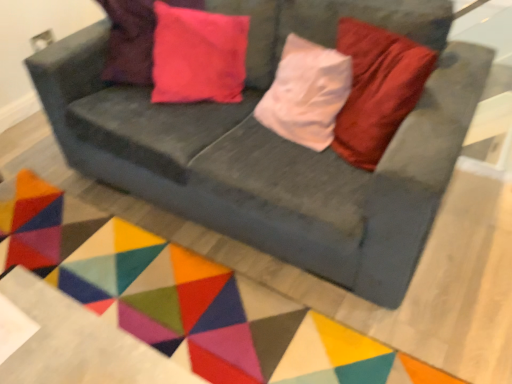
What do you see at coordinates (187, 299) in the screenshot? The height and width of the screenshot is (384, 512). I see `geometric fabric mat at center` at bounding box center [187, 299].

Find the location of `geometric fabric mat at center`. geometric fabric mat at center is located at coordinates (187, 299).

Is velvet gray couch at center facing towards pink velvet pillow at upper left?

Yes, velvet gray couch at center is turned towards pink velvet pillow at upper left.

Which object is positioned more to the left, velvet gray couch at center or pink velvet pillow at upper left?

pink velvet pillow at upper left.

Is velvet gray couch at center in contact with pink velvet pillow at upper left?

velvet gray couch at center and pink velvet pillow at upper left are not in contact.

Based on the photo, between velvet gray couch at center and pink velvet pillow at upper left, which one has larger width?

Wider between the two is velvet gray couch at center.

From a real-world perspective, which is physically above, velvet gray couch at center or geometric fabric mat at center?

velvet gray couch at center.

Is the depth of velvet gray couch at center greater than that of geometric fabric mat at center?

No, velvet gray couch at center is closer to the viewer.

At what (x,y) coordinates should I click in order to perform the action: click on studio couch located above the geometric fabric mat at center (from the image's perspective). Please return your answer as a coordinate pair (x, y). The image size is (512, 384). Looking at the image, I should click on (276, 145).

Is point (132, 131) closer or farther from the camera than point (114, 269)?

Point (132, 131) appears to be closer to the viewer than point (114, 269).

This screenshot has height=384, width=512. In order to click on pillow above the velvet gray couch at center (from a real-world perspective) in this screenshot , I will do `click(198, 55)`.

Does pink velvet pillow at upper left have a smaller size compared to velvet gray couch at center?

Indeed, pink velvet pillow at upper left has a smaller size compared to velvet gray couch at center.

From a real-world perspective, is pink velvet pillow at upper left positioned over velvet gray couch at center based on gravity?

Yes, from a real-world perspective, pink velvet pillow at upper left is on top of velvet gray couch at center.

Is pink velvet pillow at upper left oriented away from velvet gray couch at center?

Yes, pink velvet pillow at upper left's orientation is away from velvet gray couch at center.

Is point (53, 209) closer or farther from the camera than point (244, 110)?

Point (53, 209) appears to be farther away from the viewer than point (244, 110).

Which of these two, geometric fabric mat at center or velvet gray couch at center, is bigger?

velvet gray couch at center.

The image size is (512, 384). In order to click on mat located on the left of velvet gray couch at center in this screenshot , I will do `click(187, 299)`.

Based on their positions, is geometric fabric mat at center located to the left or right of velvet gray couch at center?

Based on their positions, geometric fabric mat at center is located to the left of velvet gray couch at center.

Is pink velvet pillow at upper left wider than geometric fabric mat at center?

In fact, pink velvet pillow at upper left might be narrower than geometric fabric mat at center.

Is pink velvet pillow at upper left not within geometric fabric mat at center?

Indeed, pink velvet pillow at upper left is completely outside geometric fabric mat at center.

Does pink velvet pillow at upper left touch geometric fabric mat at center?

pink velvet pillow at upper left is not next to geometric fabric mat at center, and they're not touching.

Which is nearer, (173, 69) or (169, 271)?

Point (173, 69) appears to be farther away from the viewer than point (169, 271).

In the scene shown: Does geometric fabric mat at center appear on the right side of pink velvet pillow at upper left?

Incorrect, geometric fabric mat at center is not on the right side of pink velvet pillow at upper left.

Measure the distance between geometric fabric mat at center and pink velvet pillow at upper left.

The distance of geometric fabric mat at center from pink velvet pillow at upper left is 83.05 centimeters.

Considering the relative sizes of geometric fabric mat at center and pink velvet pillow at upper left in the image provided, is geometric fabric mat at center bigger than pink velvet pillow at upper left?

No, geometric fabric mat at center is not bigger than pink velvet pillow at upper left.

The width and height of the screenshot is (512, 384). Identify the location of studio couch below the pink velvet pillow at upper left (from a real-world perspective). (276, 145).

The image size is (512, 384). I want to click on mat below the velvet gray couch at center (from the image's perspective), so click(187, 299).

Considering their positions, is velvet gray couch at center positioned further to geometric fabric mat at center than pink velvet pillow at upper left?

The object further to geometric fabric mat at center is pink velvet pillow at upper left.

When comparing their distances from velvet gray couch at center, does pink velvet pillow at upper left or geometric fabric mat at center seem further?

geometric fabric mat at center lies further to velvet gray couch at center than the other object.

Looking at the image, which one is located further to geometric fabric mat at center, pink velvet pillow at upper left or velvet gray couch at center?

pink velvet pillow at upper left lies further to geometric fabric mat at center than the other object.

Looking at the image, which one is located closer to velvet gray couch at center, geometric fabric mat at center or pink velvet pillow at upper left?

pink velvet pillow at upper left.

Estimate the real-world distances between objects in this image. Which object is further from pink velvet pillow at upper left, geometric fabric mat at center or velvet gray couch at center?

geometric fabric mat at center lies further to pink velvet pillow at upper left than the other object.

When comparing their distances from pink velvet pillow at upper left, does velvet gray couch at center or geometric fabric mat at center seem closer?

velvet gray couch at center is positioned closer to the anchor pink velvet pillow at upper left.

Identify the location of studio couch that lies between pink velvet pillow at upper left and geometric fabric mat at center from top to bottom. The image size is (512, 384). pyautogui.click(x=276, y=145).